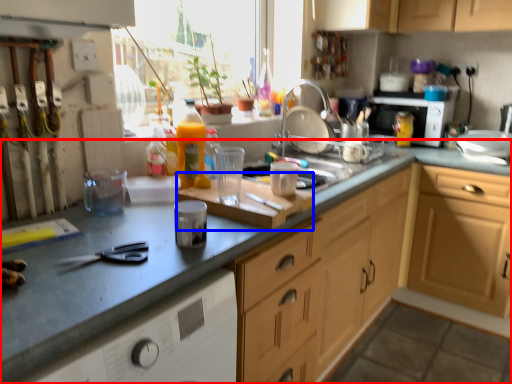
Question: Which object appears closest to the camera in this image, countertop (highlighted by a red box) or cutting board (highlighted by a blue box)?

Choices:
 (A) countertop
 (B) cutting board

Answer: (A)